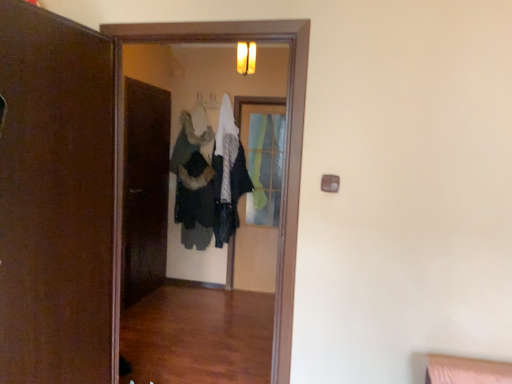
Locate an element on the screen. This screenshot has width=512, height=384. free space in front of clear glass screen door at center, which appears as the second screen door when viewed from the front is located at coordinates (257, 297).